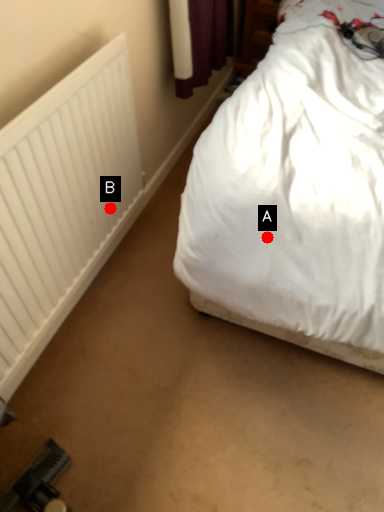
Question: Two points are circled on the image, labeled by A and B beside each circle. Which point is closer to the camera?

Choices:
 (A) A is closer
 (B) B is closer

Answer: (A)